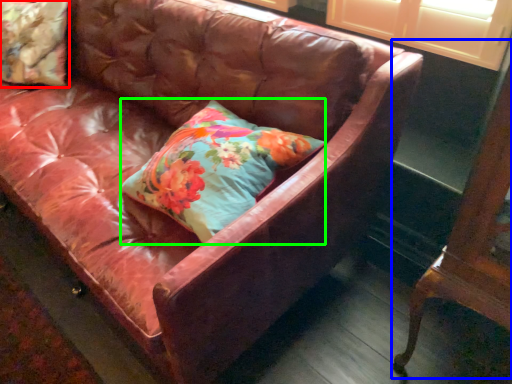
Question: Based on their relative distances, which object is nearer to pillow (highlighted by a red box)? Choose from furniture (highlighted by a blue box) and pillow (highlighted by a green box).

Choices:
 (A) furniture
 (B) pillow

Answer: (B)